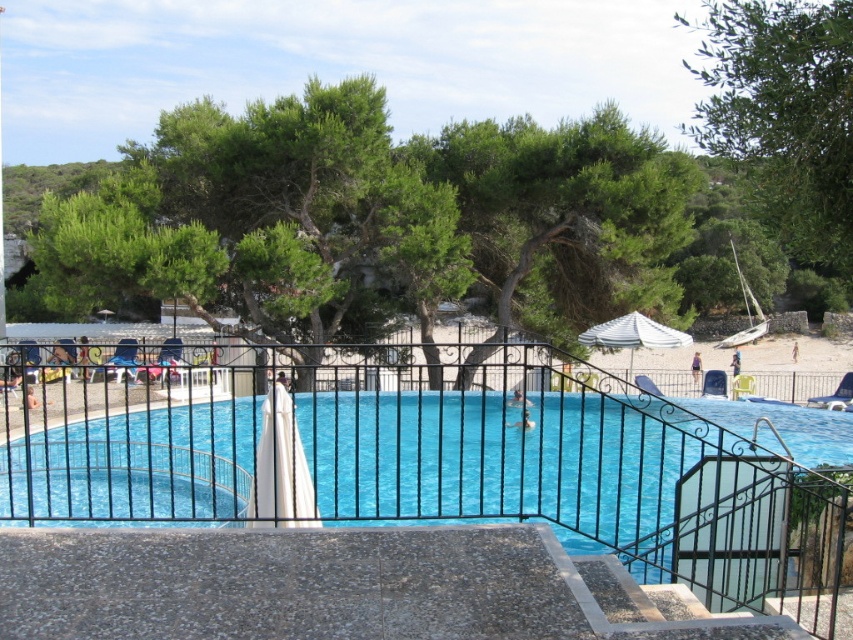
Question: Which point is farther from the camera taking this photo?

Choices:
 (A) (242, 445)
 (B) (770, 108)
 (C) (422, 253)

Answer: (C)

Question: Which of these objects is positioned farthest from the green leafy tree at center?

Choices:
 (A) green leafy tree at upper right
 (B) blue glossy water at center

Answer: (A)

Question: Can you confirm if green leafy tree at center is bigger than green leafy tree at upper right?

Choices:
 (A) no
 (B) yes

Answer: (A)

Question: Does blue glossy water at center appear over green leafy tree at upper right?

Choices:
 (A) yes
 (B) no

Answer: (B)

Question: Does blue glossy water at center appear under green leafy tree at upper right?

Choices:
 (A) yes
 (B) no

Answer: (A)

Question: Estimate the real-world distances between objects in this image. Which object is closer to the blue glossy water at center?

Choices:
 (A) green leafy tree at center
 (B) green leafy tree at upper right

Answer: (A)